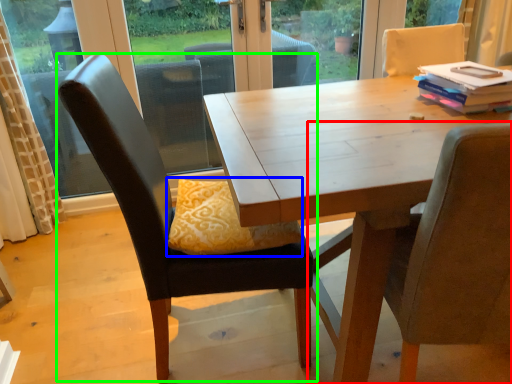
Question: Which is nearer to the chair (highlighted by a red box)? pillow (highlighted by a blue box) or chair (highlighted by a green box).

Choices:
 (A) pillow
 (B) chair

Answer: (A)